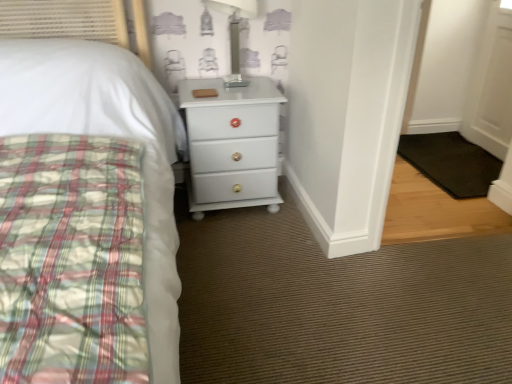
Question: Considering the relative positions of white glossy chest of drawers at center and black rubber mat at lower right in the image provided, is white glossy chest of drawers at center behind black rubber mat at lower right?

Choices:
 (A) no
 (B) yes

Answer: (A)

Question: Does white glossy chest of drawers at center have a lesser width compared to black rubber mat at lower right?

Choices:
 (A) no
 (B) yes

Answer: (B)

Question: Is white glossy chest of drawers at center oriented towards black rubber mat at lower right?

Choices:
 (A) no
 (B) yes

Answer: (A)

Question: Can you confirm if white glossy chest of drawers at center is bigger than black rubber mat at lower right?

Choices:
 (A) no
 (B) yes

Answer: (B)

Question: Does white glossy chest of drawers at center have a smaller size compared to black rubber mat at lower right?

Choices:
 (A) no
 (B) yes

Answer: (A)

Question: Looking at their shapes, would you say black rubber mat at lower right is wider or thinner than transparent glass table lamp at upper center?

Choices:
 (A) thin
 (B) wide

Answer: (B)

Question: From the image's perspective, is black rubber mat at lower right located above or below transparent glass table lamp at upper center?

Choices:
 (A) below
 (B) above

Answer: (A)

Question: Which is correct: black rubber mat at lower right is inside transparent glass table lamp at upper center, or outside of it?

Choices:
 (A) outside
 (B) inside

Answer: (A)

Question: Is black rubber mat at lower right in front of or behind transparent glass table lamp at upper center in the image?

Choices:
 (A) behind
 (B) front

Answer: (A)

Question: In the image, is white glossy chest of drawers at center positioned in front of or behind transparent glass table lamp at upper center?

Choices:
 (A) front
 (B) behind

Answer: (B)

Question: From the image's perspective, is white glossy chest of drawers at center located above or below transparent glass table lamp at upper center?

Choices:
 (A) below
 (B) above

Answer: (A)

Question: From their relative heights in the image, would you say white glossy chest of drawers at center is taller or shorter than transparent glass table lamp at upper center?

Choices:
 (A) short
 (B) tall

Answer: (B)

Question: Is white glossy chest of drawers at center situated inside transparent glass table lamp at upper center or outside?

Choices:
 (A) outside
 (B) inside

Answer: (A)

Question: Considering the positions of point (237, 72) and point (246, 198), is point (237, 72) closer or farther from the camera than point (246, 198)?

Choices:
 (A) farther
 (B) closer

Answer: (A)

Question: Looking at their shapes, would you say transparent glass table lamp at upper center is wider or thinner than white glossy chest of drawers at center?

Choices:
 (A) wide
 (B) thin

Answer: (B)